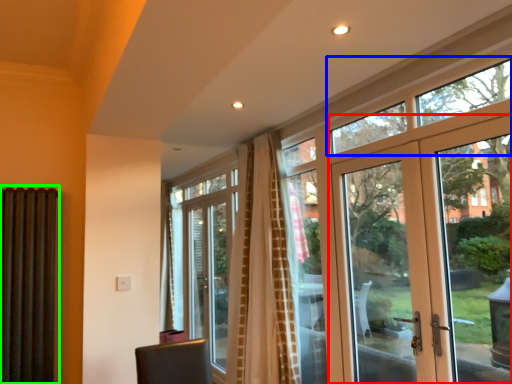
Question: Which is nearer to the door (highlighted by a red box)? window (highlighted by a blue box) or shutter (highlighted by a green box).

Choices:
 (A) window
 (B) shutter

Answer: (A)